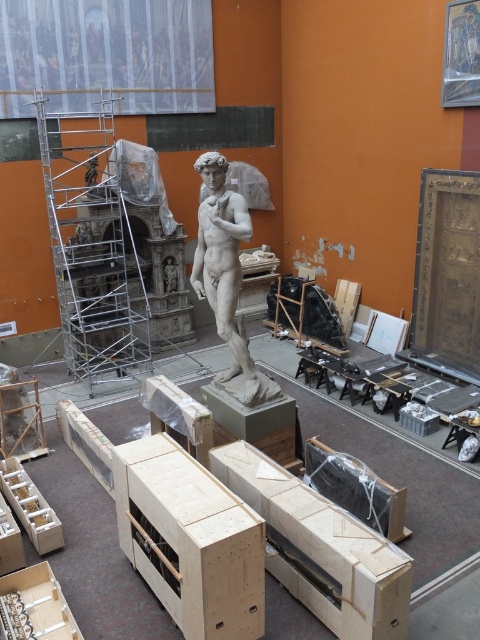
Between point (144, 358) and point (229, 371), which one is positioned in front?

Point (229, 371) is in front.

Between silver metallic scaffolding at left and white marble statue at center, which one has more height?

silver metallic scaffolding at left

The height and width of the screenshot is (640, 480). What do you see at coordinates (93, 246) in the screenshot? I see `silver metallic scaffolding at left` at bounding box center [93, 246].

You are a GUI agent. You are given a task and a screenshot of the screen. Output one action in this format:
    pyautogui.click(x=<x>, y=<y>)
    Task: Click on the silver metallic scaffolding at left
    The height and width of the screenshot is (640, 480).
    Given the screenshot: What is the action you would take?
    pyautogui.click(x=93, y=246)